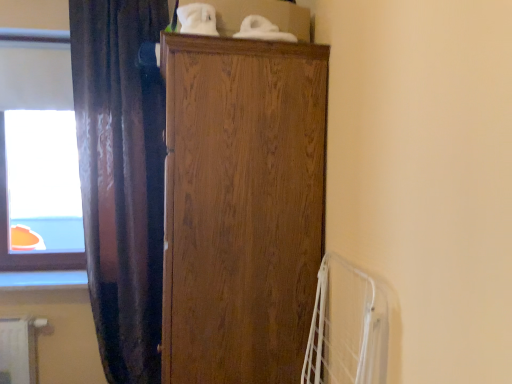
Question: Can you confirm if wooden cabinet at center is shorter than dark velvet curtain at left?

Choices:
 (A) yes
 (B) no

Answer: (A)

Question: Is dark velvet curtain at left a part of wooden cabinet at center?

Choices:
 (A) yes
 (B) no

Answer: (B)

Question: Is wooden cabinet at center positioned beyond the bounds of dark velvet curtain at left?

Choices:
 (A) yes
 (B) no

Answer: (A)

Question: Is wooden cabinet at center behind dark velvet curtain at left?

Choices:
 (A) no
 (B) yes

Answer: (A)

Question: Is wooden cabinet at center not near dark velvet curtain at left?

Choices:
 (A) no
 (B) yes

Answer: (A)

Question: Is wooden cabinet at center oriented towards dark velvet curtain at left?

Choices:
 (A) yes
 (B) no

Answer: (A)

Question: Does dark velvet curtain at left appear on the right side of wooden cabinet at center?

Choices:
 (A) no
 (B) yes

Answer: (A)

Question: Does dark velvet curtain at left have a smaller size compared to wooden cabinet at center?

Choices:
 (A) yes
 (B) no

Answer: (A)

Question: Are dark velvet curtain at left and wooden cabinet at center beside each other?

Choices:
 (A) yes
 (B) no

Answer: (B)

Question: Is dark velvet curtain at left to the left of wooden cabinet at center from the viewer's perspective?

Choices:
 (A) yes
 (B) no

Answer: (A)

Question: Is dark velvet curtain at left taller than wooden cabinet at center?

Choices:
 (A) yes
 (B) no

Answer: (A)

Question: From the image's perspective, does dark velvet curtain at left appear lower than wooden cabinet at center?

Choices:
 (A) yes
 (B) no

Answer: (B)

Question: From the image's perspective, is wooden cabinet at center on transparent glass window at upper left?

Choices:
 (A) yes
 (B) no

Answer: (B)